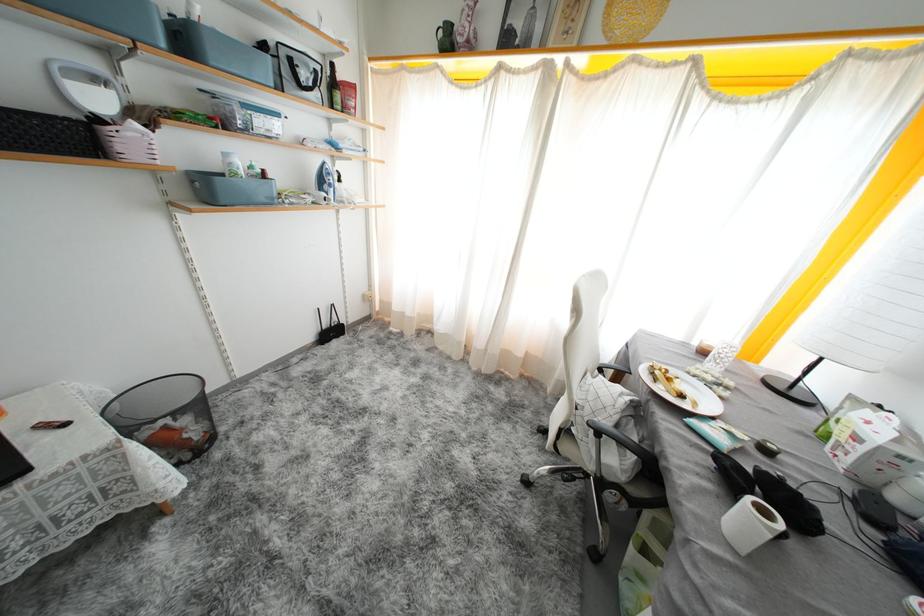
Find the location of a particular element. The width and height of the screenshot is (924, 616). dark green bottle is located at coordinates (333, 87).